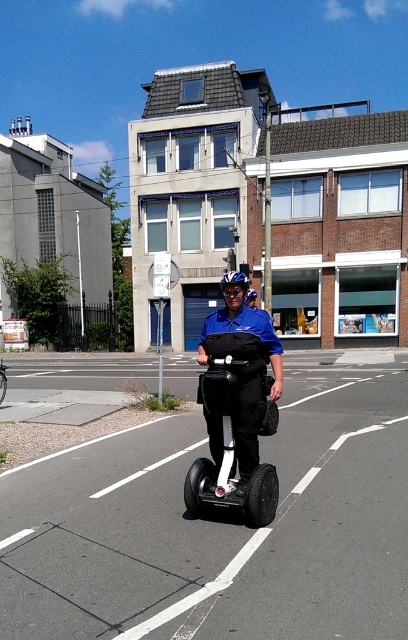
You are a pedestrian standing on the sidewalk next to the road where the matte blue uniform at center and the white glossy scooter at center are located. Which object is closer to your left side?

The matte blue uniform at center is closer to your left side because it is positioned to the left of the white glossy scooter at center.

You are a pedestrian standing on the sidewalk and see the matte blue uniform at center and the white glossy scooter at center in the middle of the road. Which object is covering the other one?

The matte blue uniform at center is positioned over white glossy scooter at center, so the matte blue uniform at center is covering the white glossy scooter at center.

You are standing at the point closer to the Segway rider. Which point are you at, point (250, 474) or point (248, 364)?

You are at point (250, 474) because it is closer to the Segway rider than point (248, 364).